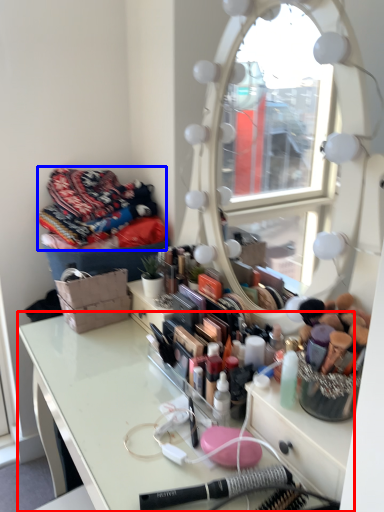
Question: Which point is closer to the camera, table (highlighted by a red box) or clothing (highlighted by a blue box)?

Choices:
 (A) table
 (B) clothing

Answer: (A)